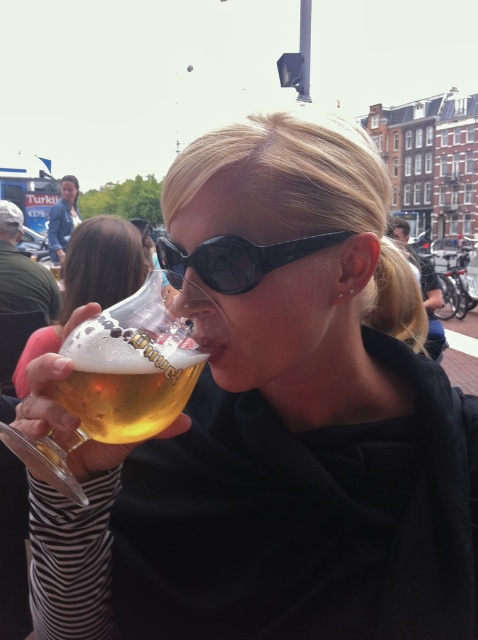
Question: Is translucent glass beer at lower left smaller than blue denim jacket at upper left?

Choices:
 (A) no
 (B) yes

Answer: (A)

Question: Which object is positioned closest to the blue denim jacket at upper left?

Choices:
 (A) golden glass beer at center
 (B) translucent glass beer at lower left

Answer: (B)

Question: Considering the relative positions of golden glass beer at center and translucent glass beer at lower left in the image provided, where is golden glass beer at center located with respect to translucent glass beer at lower left?

Choices:
 (A) above
 (B) below

Answer: (B)

Question: Among these objects, which one is farthest from the camera?

Choices:
 (A) golden glass beer at center
 (B) black plastic sunglasses at center

Answer: (B)

Question: Does golden glass beer at center have a smaller size compared to translucent glass beer at lower left?

Choices:
 (A) yes
 (B) no

Answer: (A)

Question: Which object is the farthest from the golden glass beer at center?

Choices:
 (A) translucent glass beer at lower left
 (B) black plastic sunglasses at center
 (C) blue denim jacket at upper left

Answer: (C)